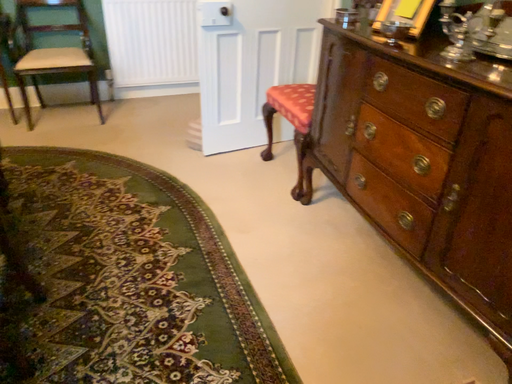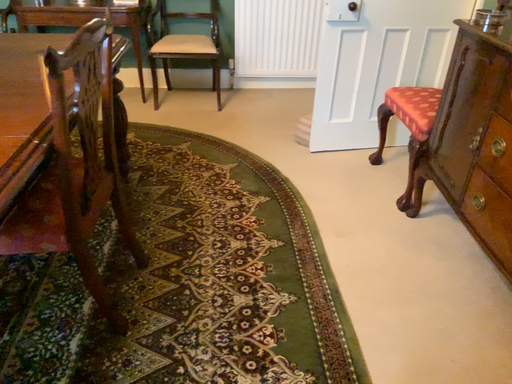
Question: Which way did the camera rotate in the video?

Choices:
 (A) rotated left
 (B) rotated right

Answer: (A)